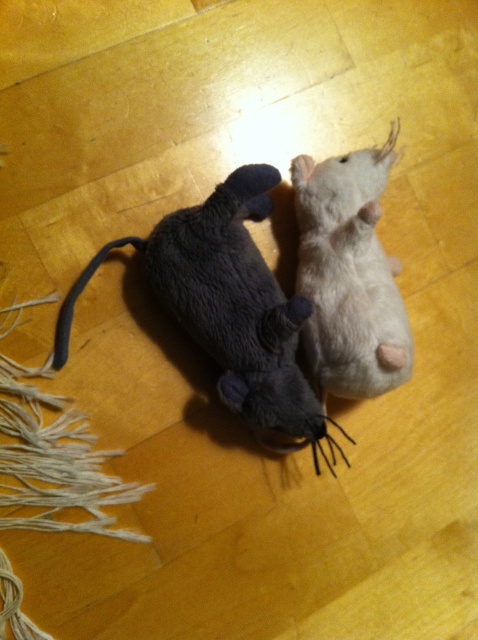
You are a child who wants to place a new toy between the dark gray plush mouse at center and the white soft toy mouse at upper right. Based on their positions, where should you place the new toy?

The dark gray plush mouse at center is positioned on the left side of the white soft toy mouse at upper right, so you should place the new toy between them, ensuring it is between the dark gray plush mouse at center and the white soft toy mouse at upper right.

You are a child who wants to place a small toy car between the dark gray plush mouse at center and the white soft toy mouse at upper right. The toy car is 5 inches long. Will it fit between them?

The dark gray plush mouse at center and the white soft toy mouse at upper right are 5.32 inches apart. Since the toy car is 5 inches long, it will fit between them with a small gap remaining.